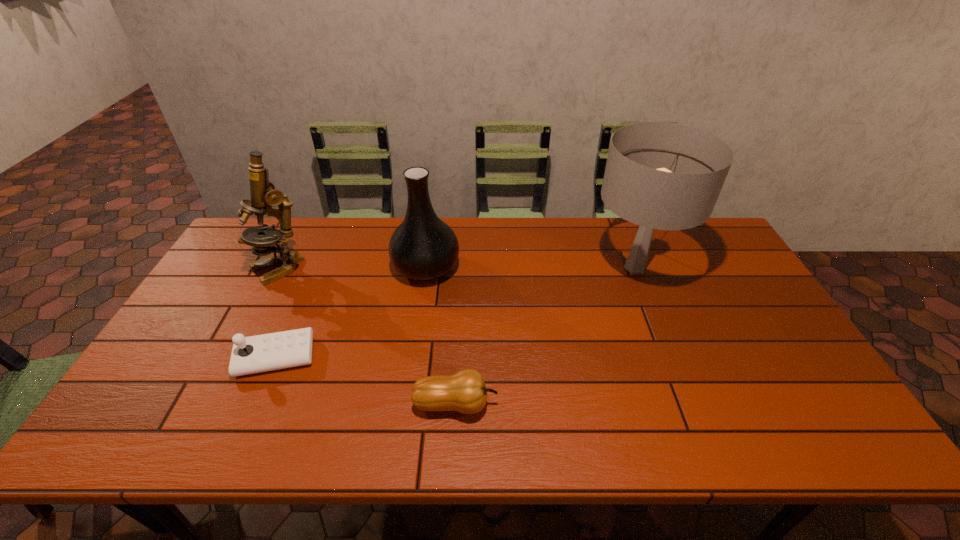
Identify the location of unoccupied area between the lampshade and the microscope. (456, 268).

Find the location of `vacant space in between the vase and the gourd`. vacant space in between the vase and the gourd is located at coordinates (441, 336).

I want to click on free area in between the nearest object and the vase, so (x=441, y=336).

Locate which object is the second closest to the microscope. Please provide its 2D coordinates. Your answer should be formatted as a tuple, i.e. [(x, y)], where the tuple contains the x and y coordinates of a point satisfying the conditions above.

[(423, 247)]

I want to click on object identified as the closest to the fourth farthest object, so tap(263, 194).

In order to click on blank space that satisfies the following two spatial constraints: 1. on the front-facing side of the lampshade; 2. on the front side of the second nearest object in this screenshot , I will do point(670,357).

Where is `free spot that satisfies the following two spatial constraints: 1. on the front-facing side of the rightmost object; 2. on the front side of the microscope`? The image size is (960, 540). free spot that satisfies the following two spatial constraints: 1. on the front-facing side of the rightmost object; 2. on the front side of the microscope is located at coordinates (636, 269).

Find the location of a particular element. The image size is (960, 540). free spot that satisfies the following two spatial constraints: 1. on the front-facing side of the rightmost object; 2. on the front side of the microscope is located at coordinates (636, 269).